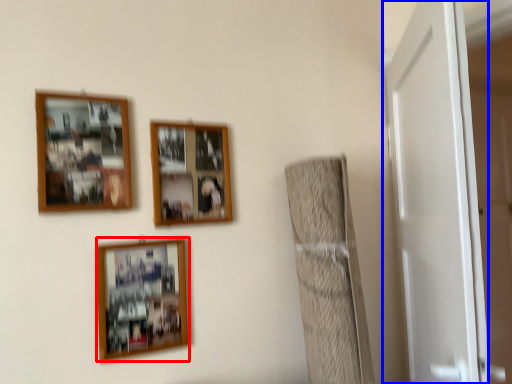
Question: Which point is closer to the camera, picture frame (highlighted by a red box) or door (highlighted by a blue box)?

Choices:
 (A) picture frame
 (B) door

Answer: (B)